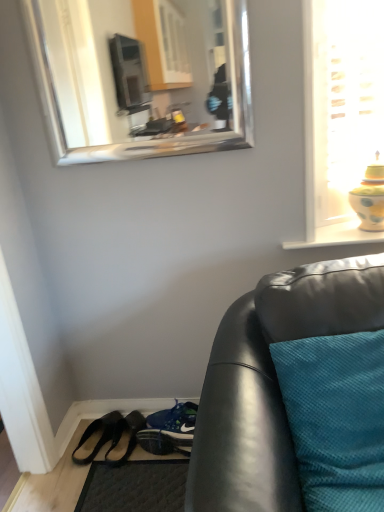
Question: Is silver/metallic mirror at upper center in contact with teal fabric cushion at lower right?

Choices:
 (A) yes
 (B) no

Answer: (B)

Question: From a real-world perspective, is silver/metallic mirror at upper center located beneath teal fabric cushion at lower right?

Choices:
 (A) no
 (B) yes

Answer: (A)

Question: Is silver/metallic mirror at upper center to the right of teal fabric cushion at lower right from the viewer's perspective?

Choices:
 (A) no
 (B) yes

Answer: (A)

Question: Does silver/metallic mirror at upper center have a greater height compared to teal fabric cushion at lower right?

Choices:
 (A) no
 (B) yes

Answer: (B)

Question: Considering the relative positions of silver/metallic mirror at upper center and teal fabric cushion at lower right in the image provided, is silver/metallic mirror at upper center in front of teal fabric cushion at lower right?

Choices:
 (A) no
 (B) yes

Answer: (A)

Question: Is silver/metallic mirror at upper center at the left side of teal fabric cushion at lower right?

Choices:
 (A) yes
 (B) no

Answer: (A)

Question: Is the position of black leather shoes at lower left, which is counted as the 1th footwear, starting from the left, less distant than that of black leather shoes at lower left, which appears as the first footwear when viewed from the right?

Choices:
 (A) yes
 (B) no

Answer: (B)

Question: From a real-world perspective, is black leather shoes at lower left, which ranks as the second footwear in right-to-left order, under black leather shoes at lower left, which appears as the first footwear when viewed from the right?

Choices:
 (A) yes
 (B) no

Answer: (A)

Question: Is black leather shoes at lower left, which ranks as the second footwear in right-to-left order, facing away from black leather shoes at lower left, positioned as the second footwear in left-to-right order?

Choices:
 (A) no
 (B) yes

Answer: (A)

Question: Is black leather shoes at lower left, which is counted as the 1th footwear, starting from the left, next to black leather shoes at lower left, which appears as the first footwear when viewed from the right, and touching it?

Choices:
 (A) no
 (B) yes

Answer: (B)

Question: Can you confirm if black leather shoes at lower left, which ranks as the second footwear in right-to-left order, is wider than black leather shoes at lower left, positioned as the second footwear in left-to-right order?

Choices:
 (A) yes
 (B) no

Answer: (A)

Question: Is the position of black leather shoes at lower left, which ranks as the second footwear in right-to-left order, more distant than that of black leather shoes at lower left, positioned as the second footwear in left-to-right order?

Choices:
 (A) yes
 (B) no

Answer: (A)

Question: Can you confirm if black leather shoes at lower left, which appears as the first footwear when viewed from the right, is shorter than black leather shoes at lower left, which is counted as the 1th footwear, starting from the left?

Choices:
 (A) no
 (B) yes

Answer: (B)